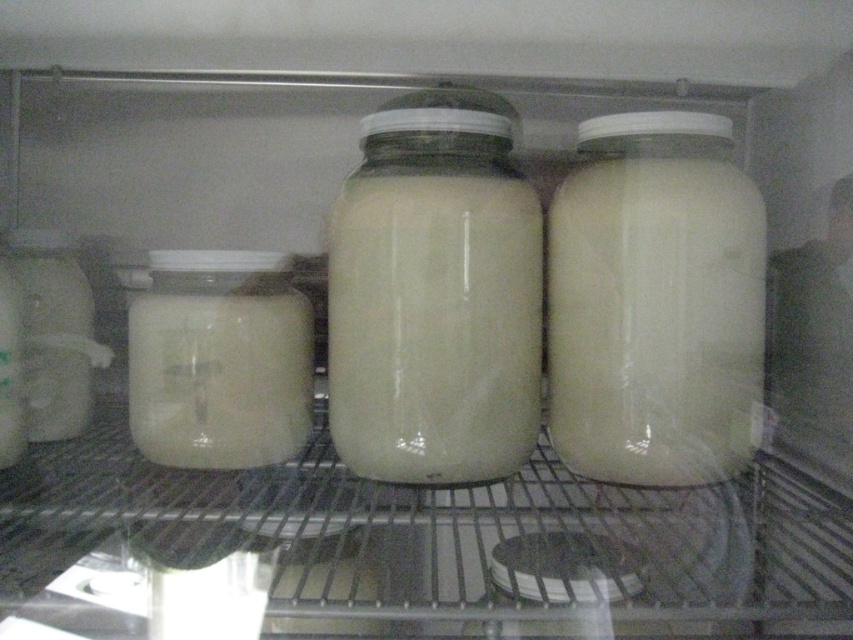
Question: Is white matte jar at left smaller than translucent glass jar at left?

Choices:
 (A) no
 (B) yes

Answer: (A)

Question: Among these points, which one is farthest from the camera?

Choices:
 (A) tap(410, 275)
 (B) tap(686, 339)
 (C) tap(134, 368)

Answer: (C)

Question: Can you confirm if white glossy jar at center is positioned below translucent glass jar at left?

Choices:
 (A) yes
 (B) no

Answer: (B)

Question: Which object is closer to the camera taking this photo?

Choices:
 (A) white matte jar at left
 (B) white glossy jar at center
 (C) white glossy jar at right
 (D) translucent glass jar at left

Answer: (C)

Question: Which point appears closest to the camera in this image?

Choices:
 (A) (560, 321)
 (B) (332, 340)
 (C) (183, 317)

Answer: (A)

Question: Is white glossy jar at center smaller than white matte jar at left?

Choices:
 (A) yes
 (B) no

Answer: (A)